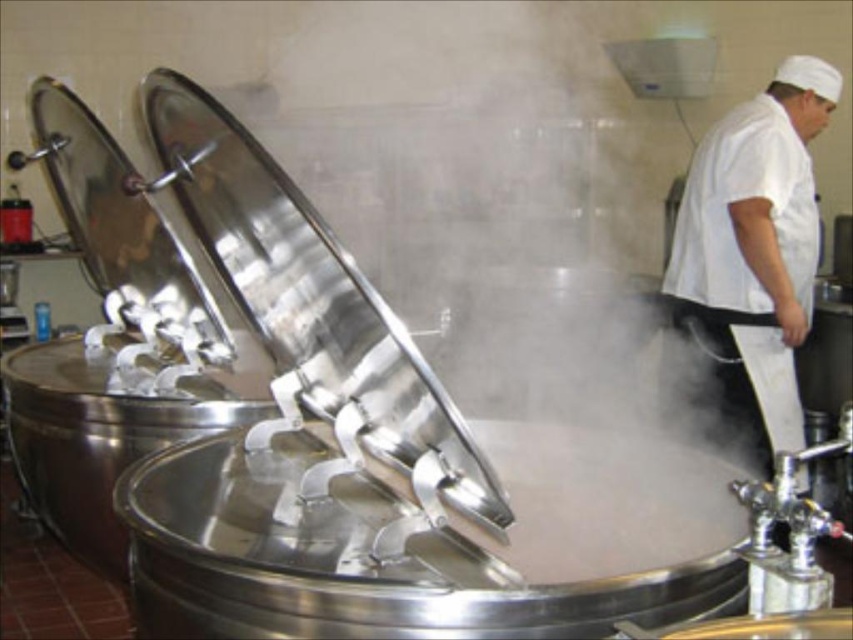
You are a maintenance worker standing in front of the polished stainless steel exhaust hood at center. Your tool box is placed on the floor 4 feet away from you. Can you reach your tool box without moving your feet?

The polished stainless steel exhaust hood at center and viewer are 3.96 feet apart. Since the tool box is 4 feet away from you, which is slightly farther than the distance between you and the exhaust hood, you might need to stretch or move slightly to reach it, but it is close enough to be accessible without moving your feet significantly.

You are an inspector in the brewery and need to check the white matte chef hat at upper right and the polished stainless steel exhaust hood at center. Which object is located to the right of the other?

The polished stainless steel exhaust hood at center is to the left of white matte chef hat at upper right, so the white matte chef hat at upper right is located to the right of the polished stainless steel exhaust hood at center.